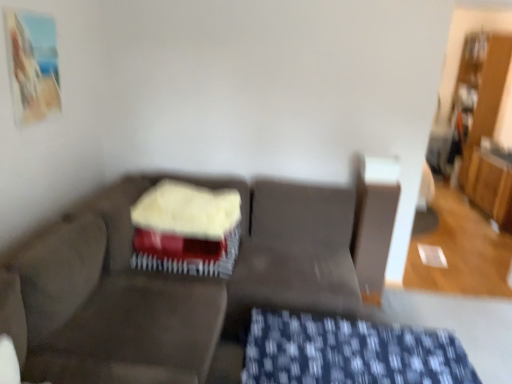
Question: Is blue textured fabric at lower center turned away from velvet-like beige swivel chair at center?

Choices:
 (A) yes
 (B) no

Answer: (A)

Question: Can you confirm if blue textured fabric at lower center is wider than velvet-like beige swivel chair at center?

Choices:
 (A) no
 (B) yes

Answer: (B)

Question: Considering the relative positions of blue textured fabric at lower center and velvet-like beige swivel chair at center in the image provided, is blue textured fabric at lower center to the left of velvet-like beige swivel chair at center from the viewer's perspective?

Choices:
 (A) no
 (B) yes

Answer: (A)

Question: Would you say blue textured fabric at lower center is a long distance from velvet-like beige swivel chair at center?

Choices:
 (A) no
 (B) yes

Answer: (A)

Question: Is blue textured fabric at lower center completely or partially outside of velvet-like beige swivel chair at center?

Choices:
 (A) yes
 (B) no

Answer: (A)

Question: Considering their positions, is blue textured fabric at lower center located in front of or behind dark gray fabric couch at center?

Choices:
 (A) behind
 (B) front

Answer: (A)

Question: In the image, is blue textured fabric at lower center on the left side or the right side of dark gray fabric couch at center?

Choices:
 (A) left
 (B) right

Answer: (B)

Question: Looking at their shapes, would you say blue textured fabric at lower center is wider or thinner than dark gray fabric couch at center?

Choices:
 (A) thin
 (B) wide

Answer: (A)

Question: From a real-world perspective, relative to dark gray fabric couch at center, is blue textured fabric at lower center vertically above or below?

Choices:
 (A) above
 (B) below

Answer: (B)

Question: From a real-world perspective, is velvet-like beige swivel chair at center above or below dark gray fabric couch at center?

Choices:
 (A) above
 (B) below

Answer: (B)

Question: Is velvet-like beige swivel chair at center in front of or behind dark gray fabric couch at center in the image?

Choices:
 (A) front
 (B) behind

Answer: (B)

Question: Based on their sizes in the image, would you say velvet-like beige swivel chair at center is bigger or smaller than dark gray fabric couch at center?

Choices:
 (A) small
 (B) big

Answer: (A)

Question: From their relative heights in the image, would you say velvet-like beige swivel chair at center is taller or shorter than dark gray fabric couch at center?

Choices:
 (A) tall
 (B) short

Answer: (B)

Question: From the image's perspective, relative to blue textured fabric at lower center, is smooth red cake at center above or below?

Choices:
 (A) below
 (B) above

Answer: (B)

Question: Is smooth red cake at center to the left or to the right of blue textured fabric at lower center in the image?

Choices:
 (A) left
 (B) right

Answer: (A)